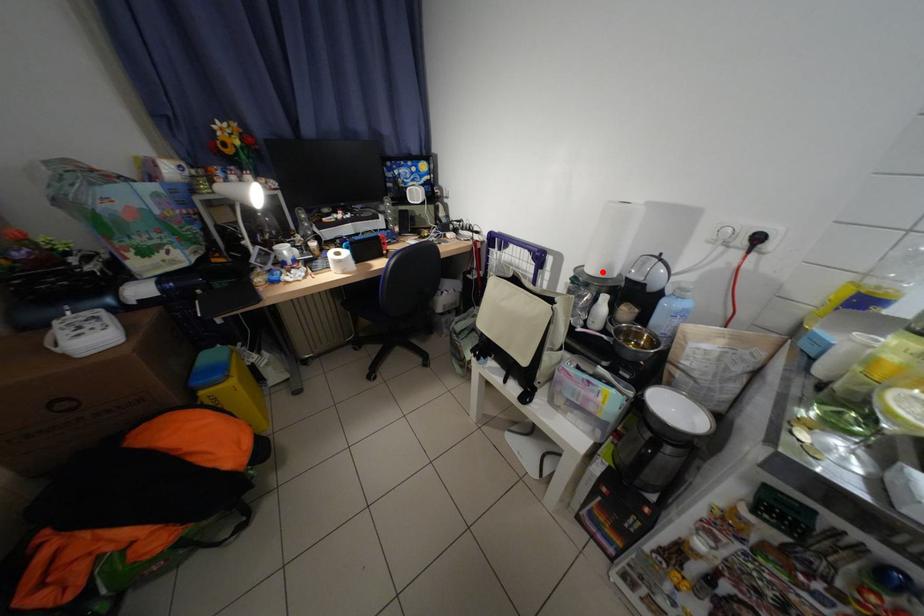
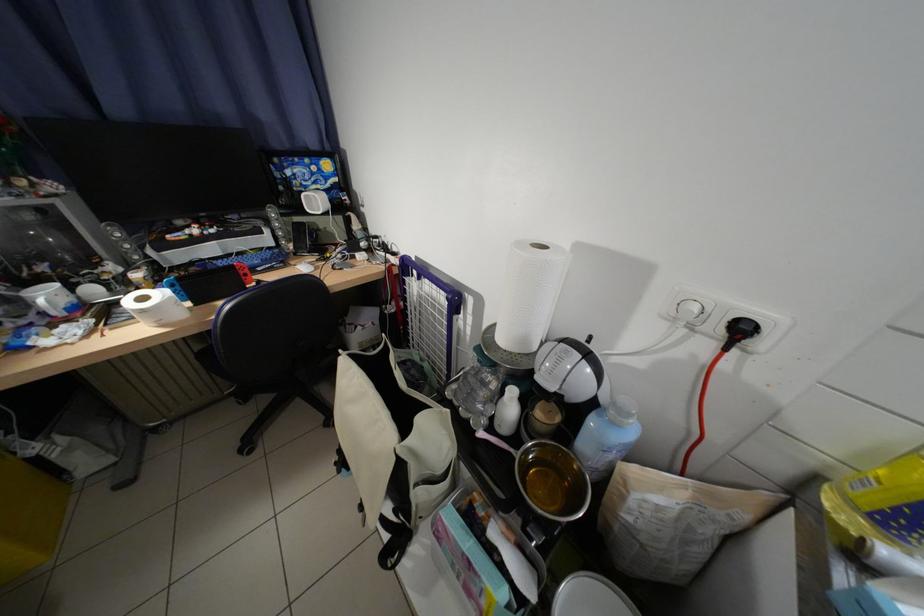
The point at the highlighted location is marked in the first image. Where is the corresponding point in the second image?

(514, 341)